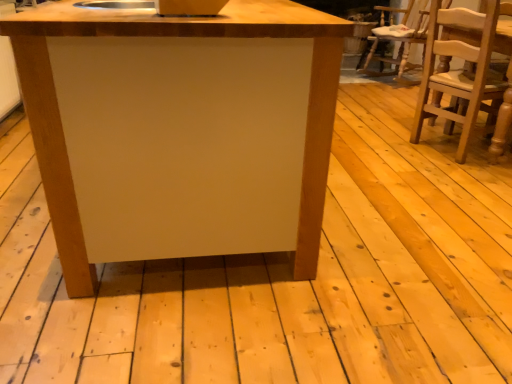
At what (x,y) coordinates should I click in order to perform the action: click on vacant area situated below light brown wooden chair at right (from a real-world perspective). Please return your answer as a coordinate pair (x, y). The height and width of the screenshot is (384, 512). Looking at the image, I should click on (435, 150).